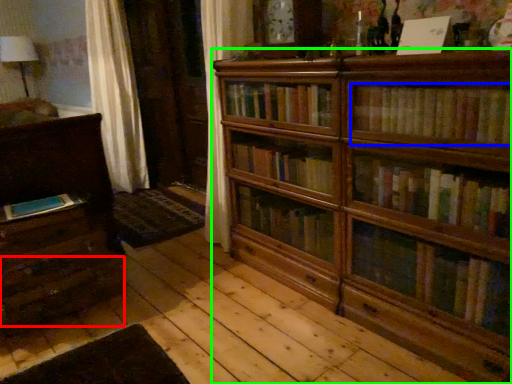
Question: Based on their relative distances, which object is farther from drawer (highlighted by a red box)? Choose from book (highlighted by a blue box) and bookcase (highlighted by a green box).

Choices:
 (A) book
 (B) bookcase

Answer: (A)